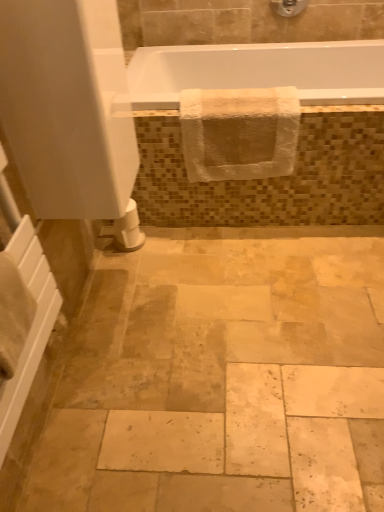
Describe the element at coordinates (289, 7) in the screenshot. I see `matte silver showerhead at upper center` at that location.

Where is `white glossy bathtub at upper center`? This screenshot has width=384, height=512. white glossy bathtub at upper center is located at coordinates 299,136.

At what (x,y) coordinates should I click in order to perform the action: click on white matte toilet paper at lower left. Please return your answer as a coordinate pair (x, y). The height and width of the screenshot is (512, 384). Looking at the image, I should click on (126, 230).

You are a GUI agent. You are given a task and a screenshot of the screen. Output one action in this format:
    pyautogui.click(x=<x>, y=<y>)
    Task: Click on the white textured towel at upper center
    
    Given the screenshot: What is the action you would take?
    pyautogui.click(x=239, y=133)

Does point (351, 88) lie behind point (282, 12)?

No, (351, 88) is in front of (282, 12).

Considering the relative positions of white glossy bathtub at upper center and matte silver showerhead at upper center in the image provided, is white glossy bathtub at upper center to the left or to the right of matte silver showerhead at upper center?

Based on their positions, white glossy bathtub at upper center is located to the left of matte silver showerhead at upper center.

Between white glossy bathtub at upper center and matte silver showerhead at upper center, which one is positioned in front?

Positioned in front is white glossy bathtub at upper center.

Which of these two, white glossy bathtub at upper center or matte silver showerhead at upper center, stands shorter?

Standing shorter between the two is white glossy bathtub at upper center.

Which object is wider, white glossy bathtub at upper center or white textured towel at upper center?

With larger width is white glossy bathtub at upper center.

Does point (181, 73) appear closer or farther from the camera than point (213, 116)?

Point (181, 73) appears to be farther away from the viewer than point (213, 116).

Is white glossy bathtub at upper center next to white textured towel at upper center?

white glossy bathtub at upper center and white textured towel at upper center are clearly separated.

Can you tell me how much white textured towel at upper center and white matte toilet paper at lower left differ in facing direction?

The facing directions of white textured towel at upper center and white matte toilet paper at lower left are 92.1 degrees apart.

Considering the positions of objects white textured towel at upper center and white matte toilet paper at lower left in the image provided, who is more to the right, white textured towel at upper center or white matte toilet paper at lower left?

Positioned to the right is white textured towel at upper center.

Which is behind, white textured towel at upper center or white matte toilet paper at lower left?

white matte toilet paper at lower left is further from the camera.

Can you confirm if matte silver showerhead at upper center is smaller than white glossy bathtub at upper center?

Yes.

From a real-world perspective, is matte silver showerhead at upper center positioned over white glossy bathtub at upper center based on gravity?

Indeed, from a real-world perspective, matte silver showerhead at upper center stands above white glossy bathtub at upper center.

From their relative heights in the image, would you say matte silver showerhead at upper center is taller or shorter than white glossy bathtub at upper center?

In the image, matte silver showerhead at upper center appears to be shorter than white glossy bathtub at upper center.

Identify the location of shower that is above the white glossy bathtub at upper center (from the image's perspective). The height and width of the screenshot is (512, 384). (289, 7).

Between matte silver showerhead at upper center and white matte screen door at upper left, which one appears on the right side from the viewer's perspective?

matte silver showerhead at upper center is more to the right.

How much distance is there between matte silver showerhead at upper center and white matte screen door at upper left?

A distance of 5.31 feet exists between matte silver showerhead at upper center and white matte screen door at upper left.

From the image's perspective, is matte silver showerhead at upper center under white matte screen door at upper left?

No, from the image's perspective, matte silver showerhead at upper center is not below white matte screen door at upper left.

Is matte silver showerhead at upper center positioned beyond the bounds of white matte screen door at upper left?

Yes.

How far apart are white textured towel at upper center and white glossy bathtub at upper center?

A distance of 5.74 inches exists between white textured towel at upper center and white glossy bathtub at upper center.

From a real-world perspective, is white textured towel at upper center under white glossy bathtub at upper center?

Incorrect, from a real-world perspective, white textured towel at upper center is higher than white glossy bathtub at upper center.

Which of these two, white textured towel at upper center or white glossy bathtub at upper center, is bigger?

With larger size is white glossy bathtub at upper center.

Where is `bath on the right of white textured towel at upper center`? bath on the right of white textured towel at upper center is located at coordinates (299, 136).

Is white textured towel at upper center not within white glossy bathtub at upper center?

white textured towel at upper center is positioned outside white glossy bathtub at upper center.

Based on the photo, is white textured towel at upper center positioned far away from white glossy bathtub at upper center?

They are positioned close to each other.

Find the location of a particular element. The image size is (384, 512). shower that appears behind the white glossy bathtub at upper center is located at coordinates (289, 7).

Where is `bath beneath the white textured towel at upper center (from a real-world perspective)`? bath beneath the white textured towel at upper center (from a real-world perspective) is located at coordinates (299, 136).

From the image, which object appears to be nearer to white glossy bathtub at upper center, matte silver showerhead at upper center or white textured towel at upper center?

white textured towel at upper center is positioned closer to the anchor white glossy bathtub at upper center.

Estimate the real-world distances between objects in this image. Which object is further from white glossy bathtub at upper center, white textured towel at upper center or matte silver showerhead at upper center?

matte silver showerhead at upper center lies further to white glossy bathtub at upper center than the other object.

Which object lies further to the anchor point white glossy bathtub at upper center, white textured towel at upper center or white matte toilet paper at lower left?

Based on the image, white matte toilet paper at lower left appears to be further to white glossy bathtub at upper center.

Consider the image. Which object lies further to the anchor point white matte screen door at upper left, matte silver showerhead at upper center or white matte toilet paper at lower left?

matte silver showerhead at upper center is positioned further to the anchor white matte screen door at upper left.

From the picture: Which object lies further to the anchor point white matte toilet paper at lower left, white matte screen door at upper left or white glossy bathtub at upper center?

white glossy bathtub at upper center is positioned further to the anchor white matte toilet paper at lower left.

Which object lies nearer to the anchor point white glossy bathtub at upper center, white matte screen door at upper left or matte silver showerhead at upper center?

Based on the image, matte silver showerhead at upper center appears to be nearer to white glossy bathtub at upper center.

When comparing their distances from white matte toilet paper at lower left, does white textured towel at upper center or white glossy bathtub at upper center seem further?

Among the two, white glossy bathtub at upper center is located further to white matte toilet paper at lower left.

Which object lies nearer to the anchor point matte silver showerhead at upper center, white matte screen door at upper left or white textured towel at upper center?

white textured towel at upper center is positioned closer to the anchor matte silver showerhead at upper center.

This screenshot has height=512, width=384. I want to click on bathtub between matte silver showerhead at upper center and white glossy bathtub at upper center in the up-down direction, so click(x=260, y=71).

At what (x,y) coordinates should I click in order to perform the action: click on bath towel positioned between white matte screen door at upper left and white matte toilet paper at lower left from near to far. Please return your answer as a coordinate pair (x, y). This screenshot has width=384, height=512. Looking at the image, I should click on (239, 133).

The height and width of the screenshot is (512, 384). I want to click on bathtub between white matte toilet paper at lower left and white glossy bathtub at upper center in the horizontal direction, so click(x=260, y=71).

The width and height of the screenshot is (384, 512). What are the coordinates of `bathtub between white matte screen door at upper left and matte silver showerhead at upper center from front to back` in the screenshot? It's located at (260, 71).